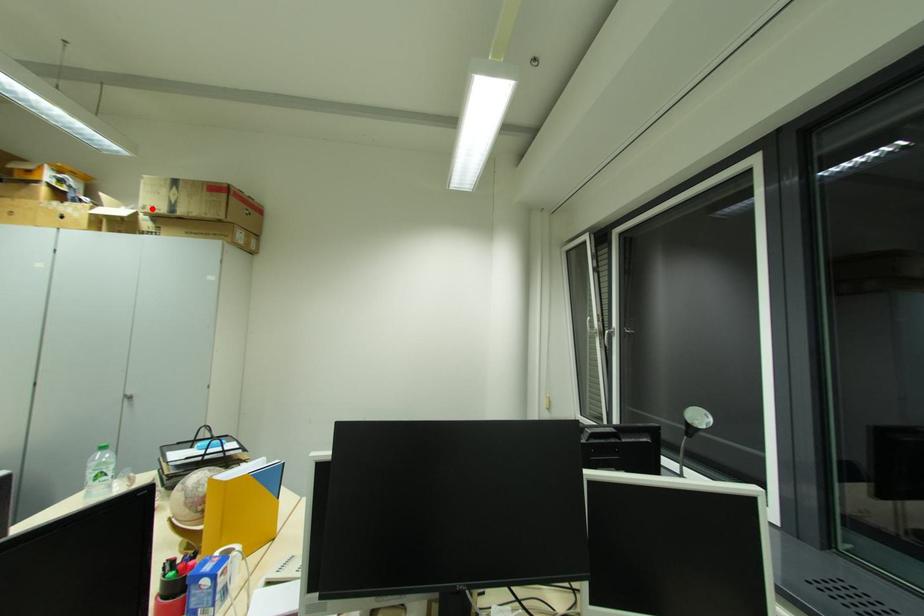
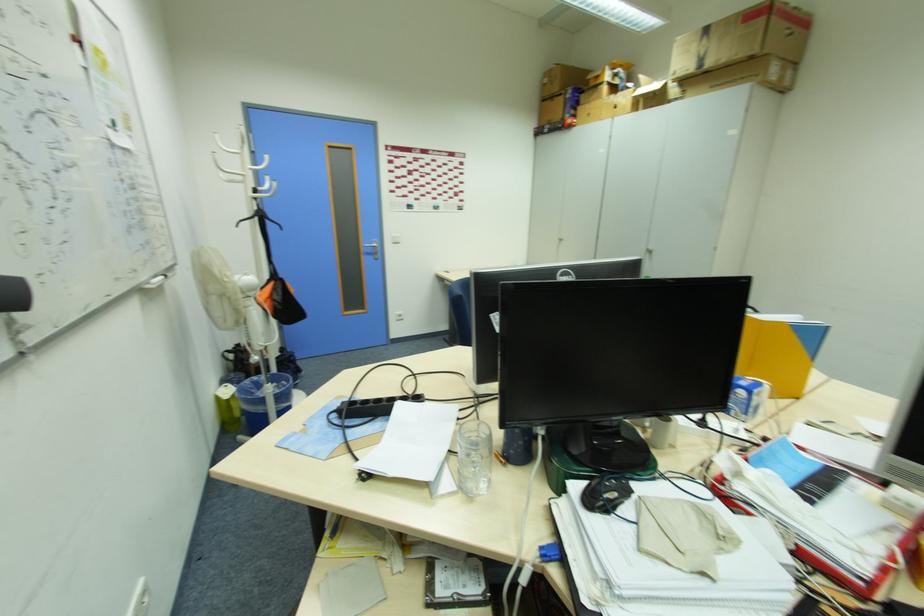
Locate, in the second image, the point that corresponds to the highlighted location in the first image.

(685, 71)